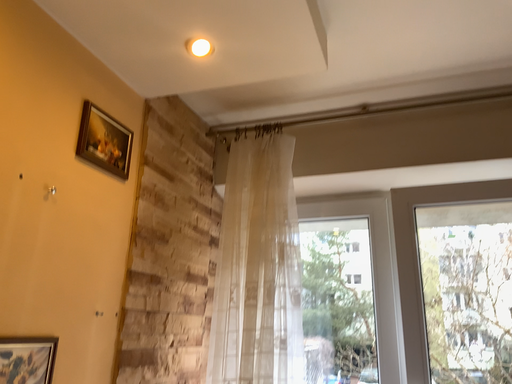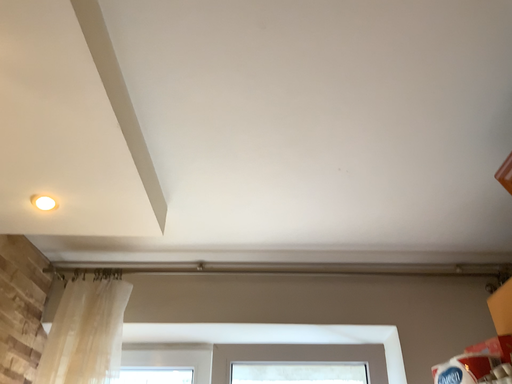
Question: Which way did the camera rotate in the video?

Choices:
 (A) rotated upward
 (B) rotated downward

Answer: (A)